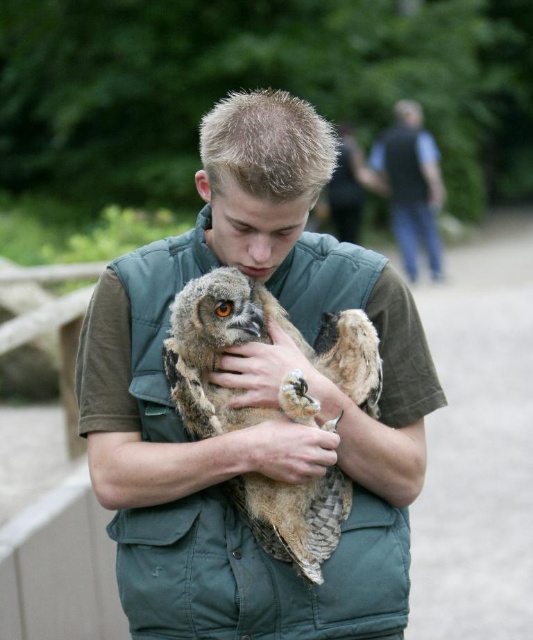
Question: Can you confirm if brown feathered owl at center is thinner than dark gray vest at upper right?

Choices:
 (A) yes
 (B) no

Answer: (A)

Question: Which is nearer to the brown feathered owl at center?

Choices:
 (A) green fabric vest at center
 (B) smooth brown skin at center
 (C) brown leather hand at center
 (D) brown textured owl at center

Answer: (C)

Question: Which object is the closest to the dark gray vest at upper right?

Choices:
 (A) brown textured owl at center
 (B) green fabric vest at center
 (C) brown feathered owl at center

Answer: (B)

Question: Can you confirm if green fabric vest at center is smaller than brown feathered owl at center?

Choices:
 (A) yes
 (B) no

Answer: (B)

Question: Can you confirm if brown textured owl at center is positioned to the left of brown leather hand at center?

Choices:
 (A) yes
 (B) no

Answer: (A)

Question: Which of the following is the farthest from the observer?

Choices:
 (A) (78, 403)
 (B) (328, 272)
 (C) (438, 154)

Answer: (C)